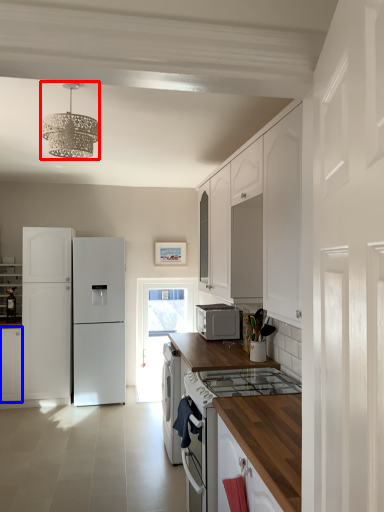
Question: Which object is further to the camera taking this photo, light fixture (highlighted by a red box) or cabinetry (highlighted by a blue box)?

Choices:
 (A) light fixture
 (B) cabinetry

Answer: (B)